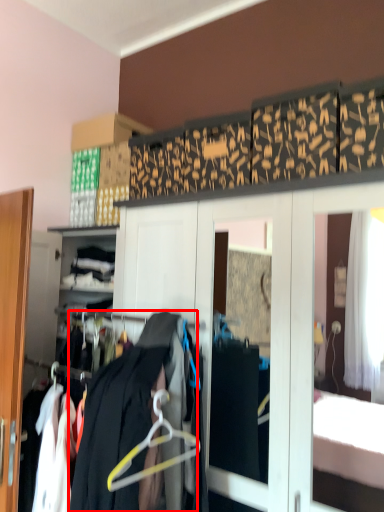
Question: From the image's perspective, considering the relative positions of clothing (annotated by the red box) and hanger in the image provided, where is clothing (annotated by the red box) located with respect to the staircase?

Choices:
 (A) above
 (B) below

Answer: (B)